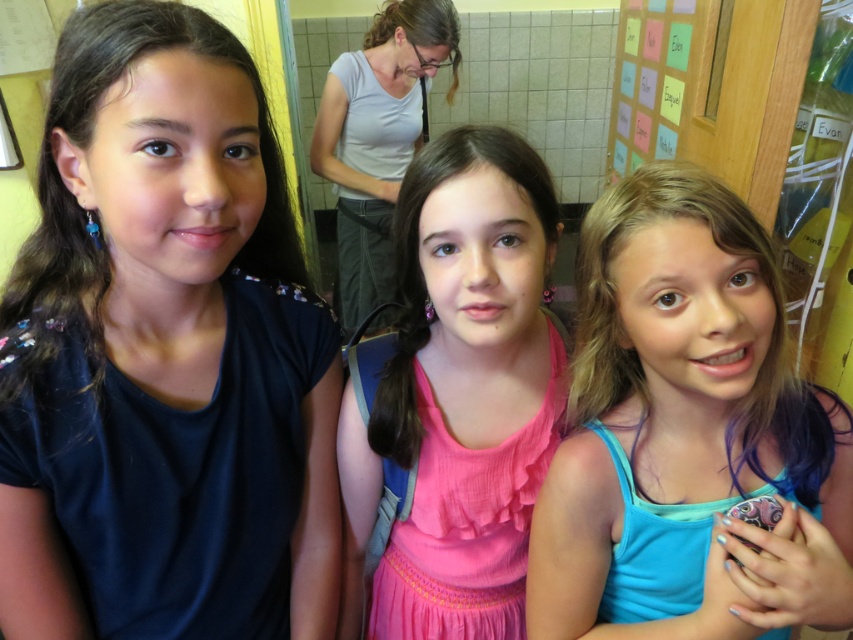
You are standing at the position of the point at coordinates point [654,218]. You want to walk straight ahead. Will you pass by the point at coordinates point [343,416] first or will it be behind you?

Since point [654,218] is in front of point [343,416], walking straight ahead from point [654,218] would mean that point [343,416] is behind you, so you will not pass by it first. The point at [343,416] will be behind you.

You are a photographer trying to capture a group photo of the three girls. You want to ensure that the dark blue fabric shirt at left and the matte gray shirt at upper left are both visible in the frame. Based on their sizes, which shirt should you focus on to ensure both are in focus?

The dark blue fabric shirt at left is smaller than the matte gray shirt at upper left. To ensure both are in focus, focus on the matte gray shirt at upper left since it is larger and will be easier to capture clearly.

You are standing in front of the three girls in the image. Which of the two shirts, the dark blue fabric shirt at left or the matte gray shirt at upper left, is positioned closer to you?

The dark blue fabric shirt at left is closer to the viewer than the matte gray shirt at upper left.